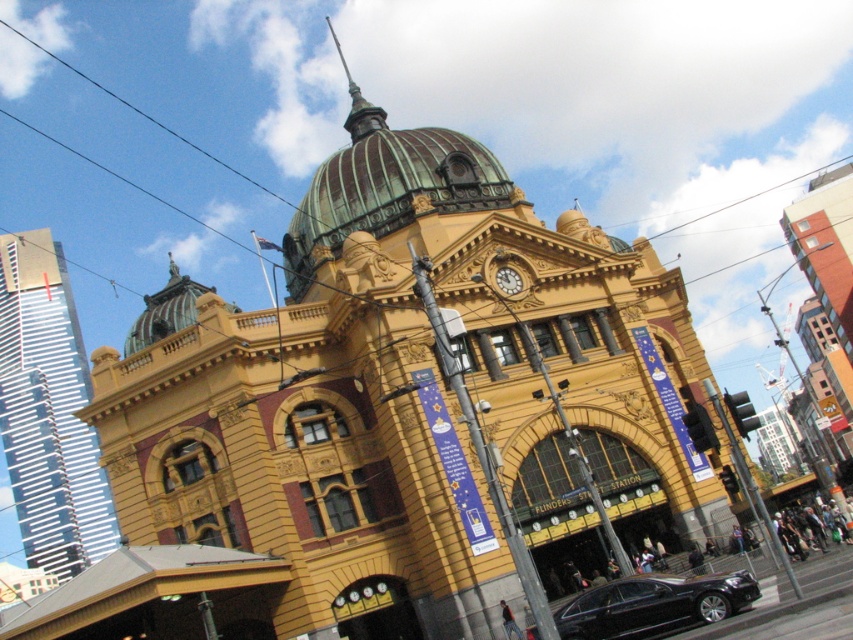
Question: Which of the following is the farthest from the observer?

Choices:
 (A) gold metallic clock at center
 (B) white glass skyscraper at left
 (C) green glass dome at upper center
 (D) black glossy sedan at lower center

Answer: (B)

Question: Is white glass skyscraper at left below black glossy sedan at lower center?

Choices:
 (A) no
 (B) yes

Answer: (A)

Question: Estimate the real-world distances between objects in this image. Which object is closer to the white glass skyscraper at left?

Choices:
 (A) black glossy sedan at lower center
 (B) gold metallic clock at center
 (C) green glass dome at upper center

Answer: (C)

Question: Which of the following is the closest to the observer?

Choices:
 (A) white glass skyscraper at left
 (B) black glossy sedan at lower center
 (C) green glass dome at upper center

Answer: (B)

Question: Does white glass skyscraper at left come in front of green glass dome at upper center?

Choices:
 (A) no
 (B) yes

Answer: (A)

Question: Can you confirm if white glass skyscraper at left is wider than gold metallic clock at center?

Choices:
 (A) yes
 (B) no

Answer: (A)